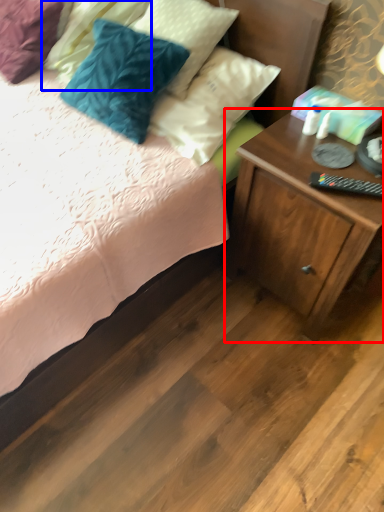
Question: Which of the following is the farthest to the observer, nightstand (highlighted by a red box) or pillow (highlighted by a blue box)?

Choices:
 (A) nightstand
 (B) pillow

Answer: (B)